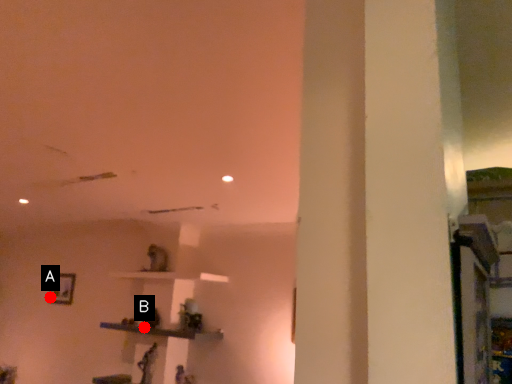
Question: Two points are circled on the image, labeled by A and B beside each circle. Which point is farther from the camera taking this photo?

Choices:
 (A) A is further
 (B) B is further

Answer: (A)